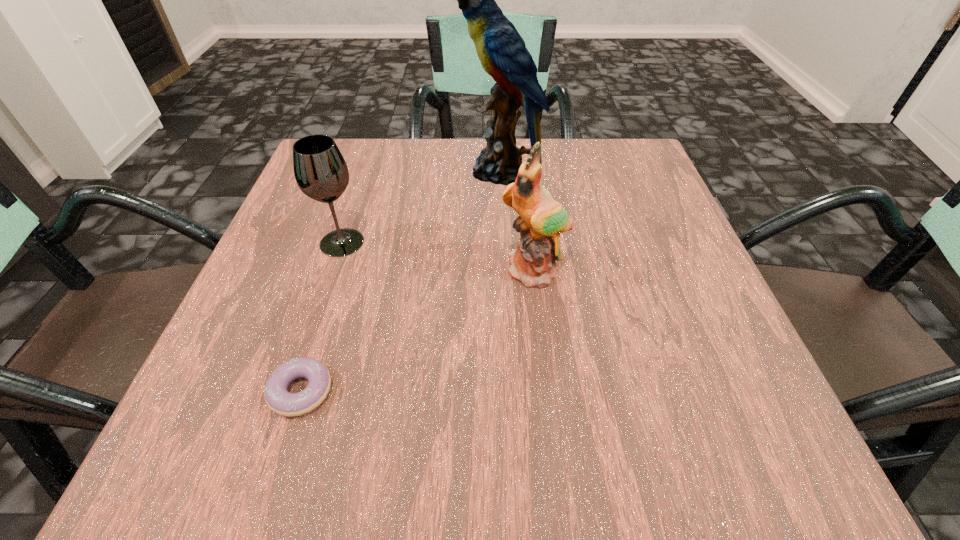
At what (x,y) coordinates should I click in order to perform the action: click on the taller parrot. Please return your answer as a coordinate pair (x, y). This screenshot has width=960, height=540. Looking at the image, I should click on (502, 52).

Identify the location of the farther parrot. Image resolution: width=960 pixels, height=540 pixels. (502, 52).

Where is `the nearer parrot`? This screenshot has height=540, width=960. the nearer parrot is located at coordinates (542, 219).

Find the location of a particular element. The image size is (960, 540). the third shortest object is located at coordinates (542, 219).

I want to click on the second shortest object, so [x=320, y=170].

Image resolution: width=960 pixels, height=540 pixels. In order to click on the shortest object in this screenshot , I will do `click(279, 400)`.

Where is `the nearest object`? This screenshot has width=960, height=540. the nearest object is located at coordinates (279, 400).

The image size is (960, 540). What are the coordinates of `vacant space situated 0.210m on the face of the farther parrot` in the screenshot? It's located at (367, 171).

At what (x,y) coordinates should I click in order to perform the action: click on vacant area located 0.200m on the face of the farther parrot. Please return your answer as a coordinate pair (x, y). This screenshot has width=960, height=540. Looking at the image, I should click on (372, 171).

Identify the location of free space located on the face of the farther parrot. (363, 171).